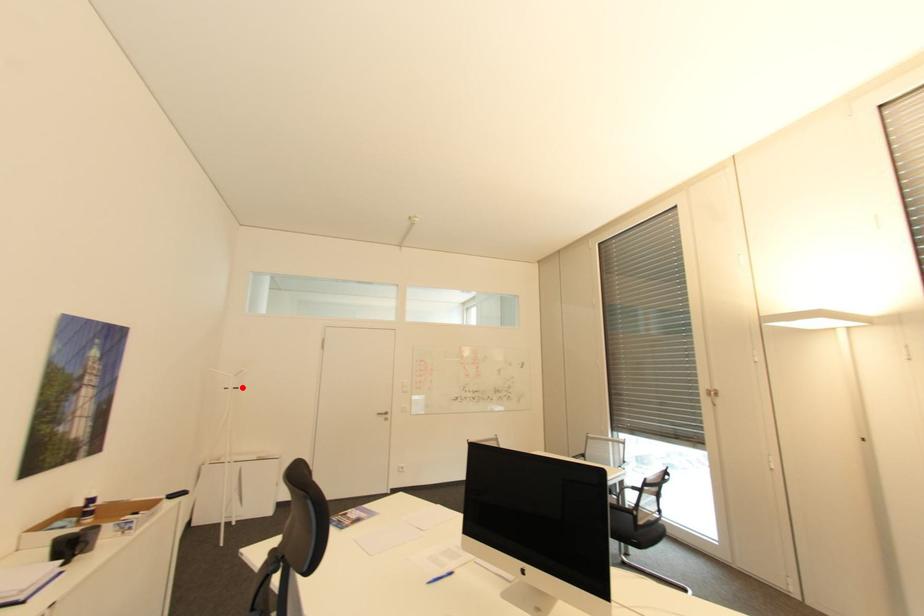
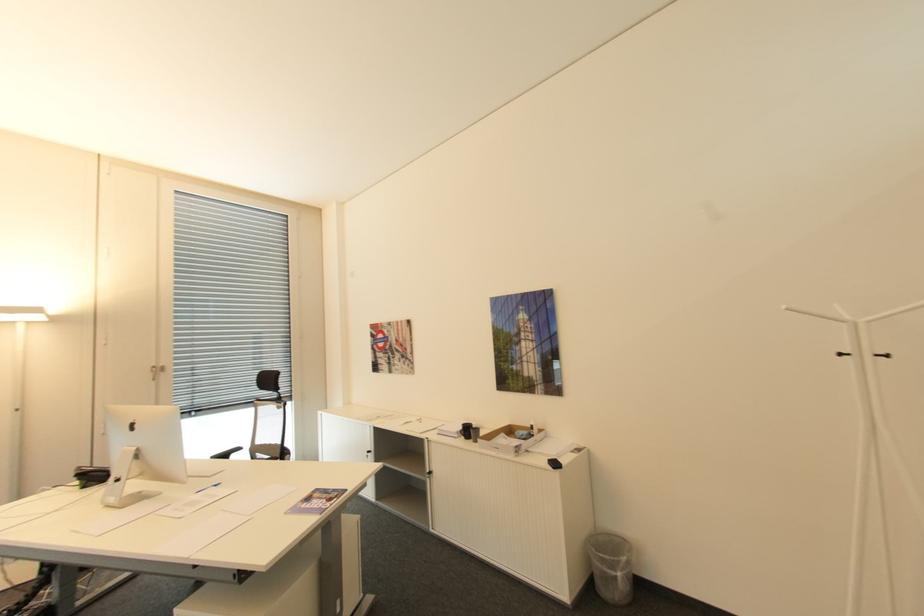
In the second image, find the point that corresponds to the highlighted location in the first image.

(894, 355)